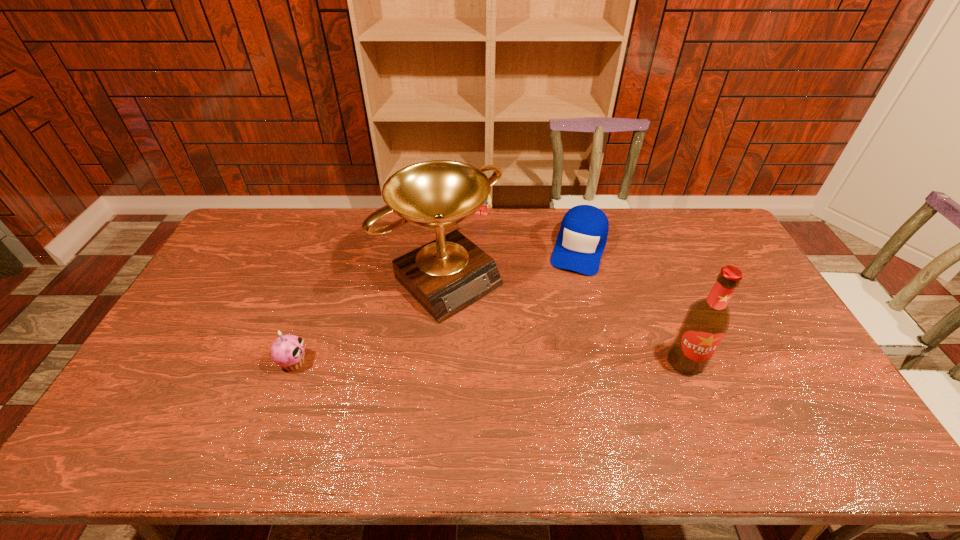
I want to click on vacant space in between the cupcake and the award, so click(369, 321).

The height and width of the screenshot is (540, 960). What are the coordinates of `vacant space in between the award and the cupcake` in the screenshot? It's located at (369, 321).

This screenshot has height=540, width=960. I want to click on the third closest object to the fourth object from left to right, so click(x=707, y=320).

The width and height of the screenshot is (960, 540). I want to click on the second closest object to the rightmost object, so click(x=449, y=274).

The height and width of the screenshot is (540, 960). Find the location of `free space that satisfies the following two spatial constraints: 1. on the back side of the award; 2. on the right side of the second object from right to left`. free space that satisfies the following two spatial constraints: 1. on the back side of the award; 2. on the right side of the second object from right to left is located at coordinates (447, 247).